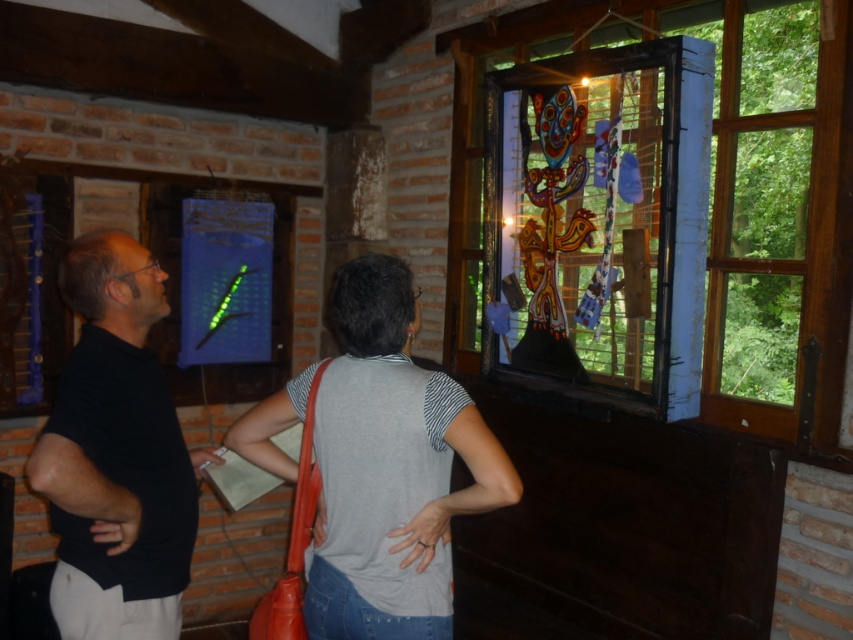
You are standing in the rustic indoor setting described. There is a stained glass window at upper right located at point (660, 209). If you want to look through the stained glass window at upper right, where should you position yourself relative to the two people?

The stained glass window at upper right is located at point (660, 209). Since the two people are standing in front of the window, you should move to their left side to have a clear view through the stained glass window at upper right.

You are a photographer trying to capture a candid shot of both the gray cotton shirt at center and the black matte shirt at left. Since you want to ensure both subjects are fully visible in the frame, which subject is closer to you and why?

The gray cotton shirt at center is closer to you because the black matte shirt at left is behind it, making the gray cotton shirt at center the more forward subject in the scene.

You are an interior designer assessing the space for a new piece of furniture. The stained glass window at upper right and the black matte shirt at left are in your line of sight. Which object is taller?

The stained glass window at upper right is much taller than the black matte shirt at left.